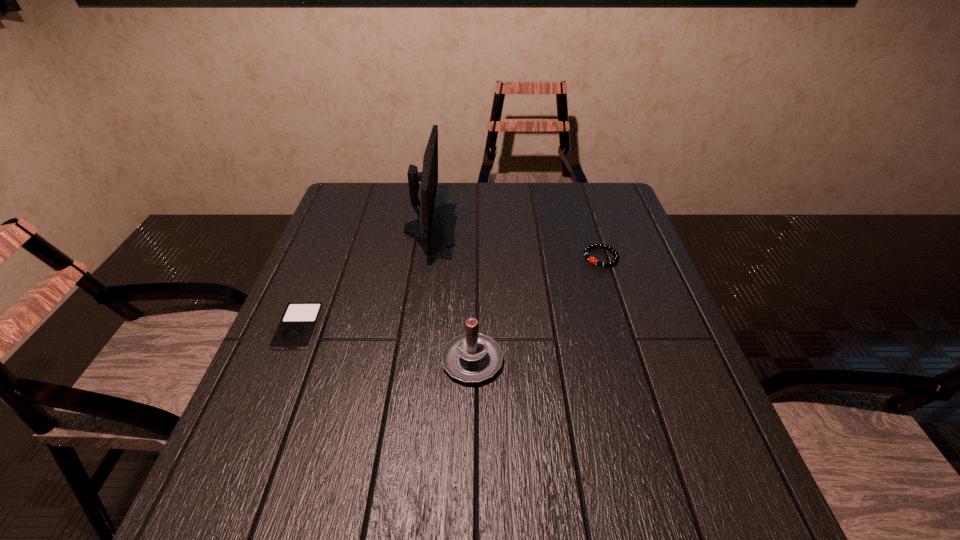
Identify which object is located as the third nearest to the third shortest object. Please provide its 2D coordinates. Your answer should be formatted as a tuple, i.e. [(x, y)], where the tuple contains the x and y coordinates of a point satisfying the conditions above.

[(586, 250)]

Where is `object that stands as the second closest to the second tallest object`? object that stands as the second closest to the second tallest object is located at coordinates (296, 329).

What are the coordinates of `blank space that satisfies the following two spatial constraints: 1. on the screen side of the tallest object; 2. on the side of the third shortest object with the handle loop` in the screenshot? It's located at (412, 358).

What are the coordinates of `vacant space that satisfies the following two spatial constraints: 1. on the back side of the second shortest object; 2. on the screen side of the monitor` in the screenshot? It's located at click(x=592, y=230).

Find the location of a particular element. vacant region that satisfies the following two spatial constraints: 1. on the screen side of the bracelet; 2. on the left side of the monitor is located at coordinates (426, 257).

Where is `free location that satisfies the following two spatial constraints: 1. on the screen side of the monitor; 2. on the left side of the bracelet`? The height and width of the screenshot is (540, 960). free location that satisfies the following two spatial constraints: 1. on the screen side of the monitor; 2. on the left side of the bracelet is located at coordinates (426, 257).

Where is `vacant space that satisfies the following two spatial constraints: 1. on the screen side of the tallest object; 2. on the side of the third shortest object with the handle loop`? The image size is (960, 540). vacant space that satisfies the following two spatial constraints: 1. on the screen side of the tallest object; 2. on the side of the third shortest object with the handle loop is located at coordinates (412, 358).

This screenshot has height=540, width=960. I want to click on vacant space that satisfies the following two spatial constraints: 1. on the side of the bracelet with the handle loop; 2. on the left side of the third shortest object, so click(x=474, y=257).

Identify the location of vacant space that satisfies the following two spatial constraints: 1. on the side of the candle with the handle loop; 2. on the screen side of the monitor. This screenshot has width=960, height=540. (474, 230).

Locate an element on the screen. Image resolution: width=960 pixels, height=540 pixels. vacant space that satisfies the following two spatial constraints: 1. on the side of the candle with the handle loop; 2. on the right side of the rightmost object is located at coordinates (474, 257).